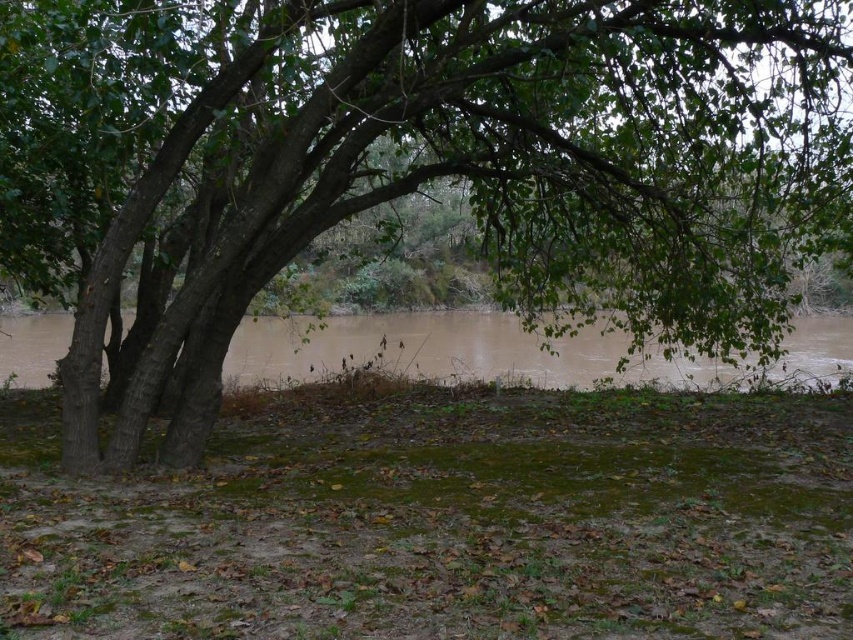
Question: Is green leafy tree at center above brown muddy water at center?

Choices:
 (A) yes
 (B) no

Answer: (A)

Question: Can you confirm if green leafy tree at center is positioned below brown muddy water at center?

Choices:
 (A) yes
 (B) no

Answer: (B)

Question: Is green leafy tree at center closer to camera compared to brown muddy water at center?

Choices:
 (A) no
 (B) yes

Answer: (B)

Question: Which point is closer to the camera?

Choices:
 (A) green leafy tree at center
 (B) brown muddy water at center

Answer: (A)

Question: Which point appears farthest from the camera in this image?

Choices:
 (A) (740, 99)
 (B) (469, 330)

Answer: (B)